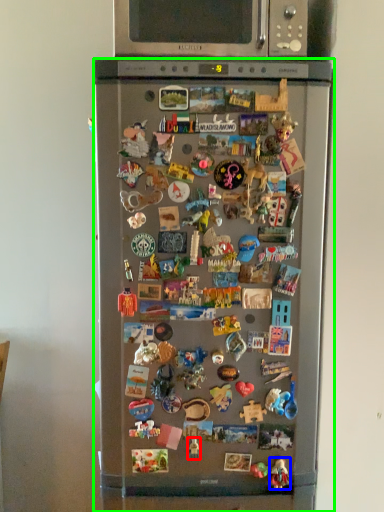
Question: Which object is the farthest from toy (highlighted by a red box)? Choose among these: toy (highlighted by a blue box) or refrigerator (highlighted by a green box).

Choices:
 (A) toy
 (B) refrigerator

Answer: (B)